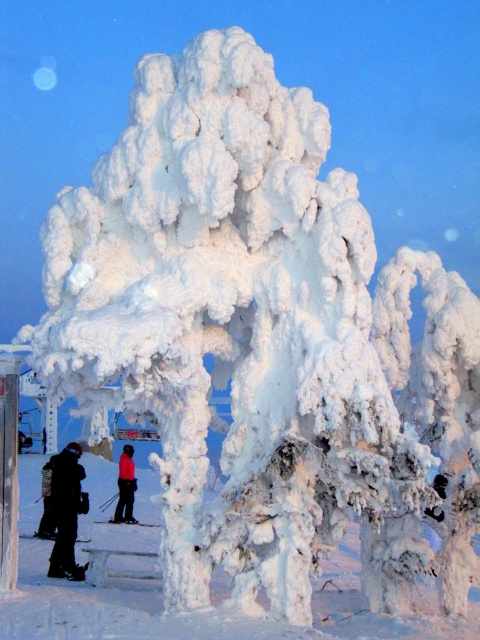
Question: Considering the real-world distances, which object is closest to the black matte snowboarder at lower left?

Choices:
 (A) red fabric skier at center
 (B) white frosty trees at center

Answer: (B)

Question: Is white frosty trees at center smaller than black matte snowboarder at lower left?

Choices:
 (A) yes
 (B) no

Answer: (B)

Question: Can you confirm if white frosty trees at center is positioned above black matte snowboarder at lower left?

Choices:
 (A) no
 (B) yes

Answer: (A)

Question: Which of the following is the closest to the observer?

Choices:
 (A) black matte snowboarder at lower left
 (B) white frosty trees at center
 (C) red fabric skier at center

Answer: (B)

Question: Estimate the real-world distances between objects in this image. Which object is farther from the white frosty trees at center?

Choices:
 (A) black matte snowboarder at lower left
 (B) red fabric skier at center

Answer: (A)

Question: In this image, where is white frosty trees at center located relative to red fabric skier at center?

Choices:
 (A) below
 (B) above

Answer: (A)